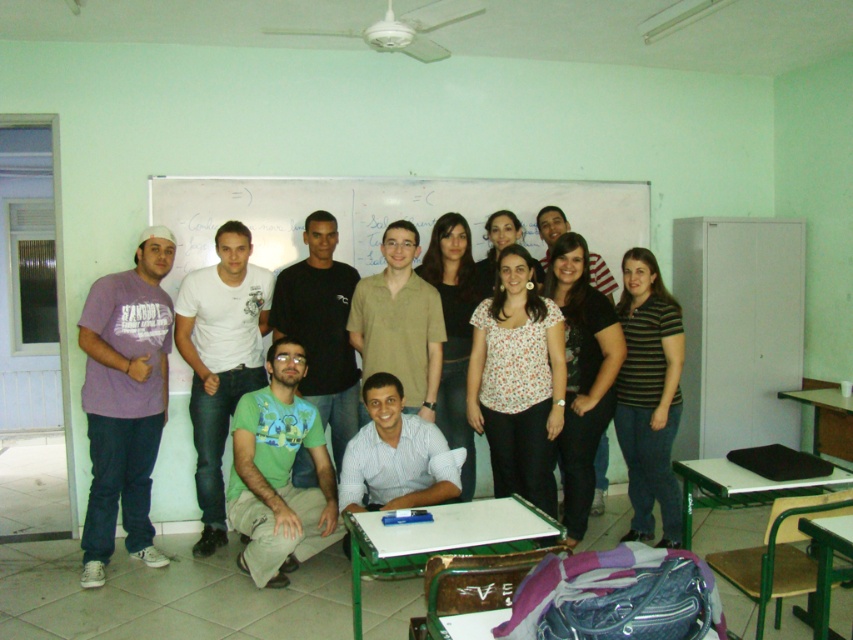
Question: Which is nearer to the green matte shirt at center?

Choices:
 (A) white dotted shirt at center
 (B) striped cotton shirt at right
 (C) whiteboard at center
 (D) white cotton shirt at left

Answer: (D)

Question: Which of the following is the farthest from the observer?

Choices:
 (A) purple cotton t-shirt at left
 (B) striped cotton shirt at right
 (C) beige cotton shirt at center

Answer: (B)

Question: Does whiteboard at center have a lesser width compared to green matte shirt at center?

Choices:
 (A) no
 (B) yes

Answer: (A)

Question: Is the position of floral print blouse at center less distant than that of green matte shirt at center?

Choices:
 (A) no
 (B) yes

Answer: (A)

Question: Is the position of white cotton shirt at left less distant than that of striped cotton shirt at right?

Choices:
 (A) no
 (B) yes

Answer: (A)

Question: Which object is farther from the camera taking this photo?

Choices:
 (A) white dotted shirt at center
 (B) white cotton shirt at left
 (C) whiteboard at center

Answer: (C)